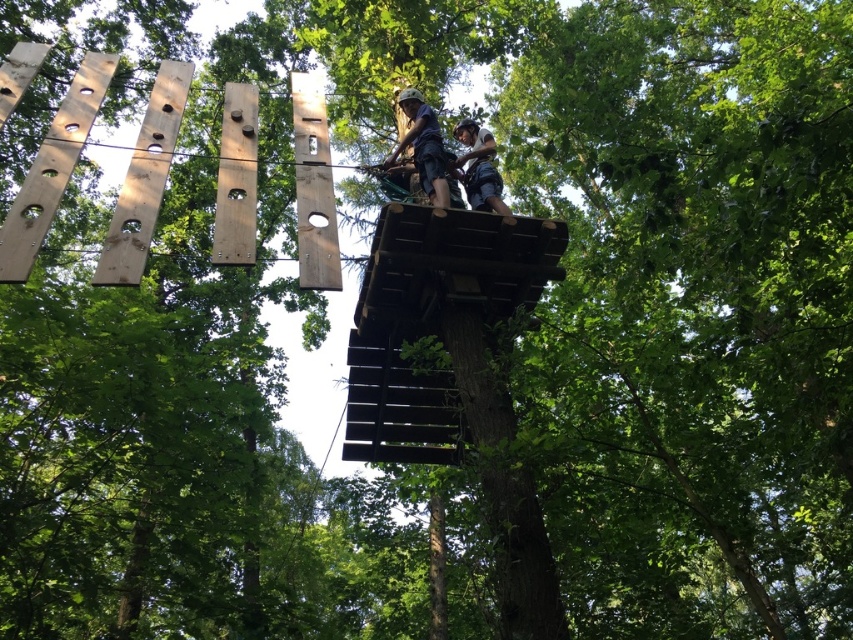
Question: Which point is closer to the camera?

Choices:
 (A) matte blue helmet at upper center
 (B) dark blue fabric harness at upper center

Answer: (B)

Question: Which point is closer to the camera?

Choices:
 (A) dark blue fabric harness at upper center
 (B) matte blue helmet at upper center

Answer: (A)

Question: In this image, where is matte blue helmet at upper center located relative to dark blue fabric harness at upper center?

Choices:
 (A) below
 (B) above

Answer: (B)

Question: Does matte blue helmet at upper center have a greater width compared to dark blue fabric harness at upper center?

Choices:
 (A) no
 (B) yes

Answer: (B)

Question: Which of the following is the closest to the observer?

Choices:
 (A) (432, 202)
 (B) (473, 156)

Answer: (A)

Question: Is matte blue helmet at upper center thinner than dark blue fabric harness at upper center?

Choices:
 (A) yes
 (B) no

Answer: (B)